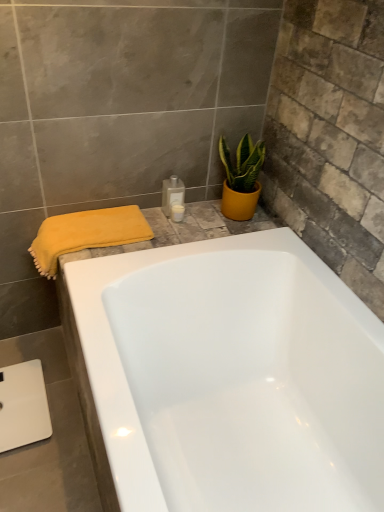
Find the location of a particular element. vacant region to the left of white glossy bottle at upper center, marked as the 1th toiletry in a bottom-to-top arrangement is located at coordinates (150, 220).